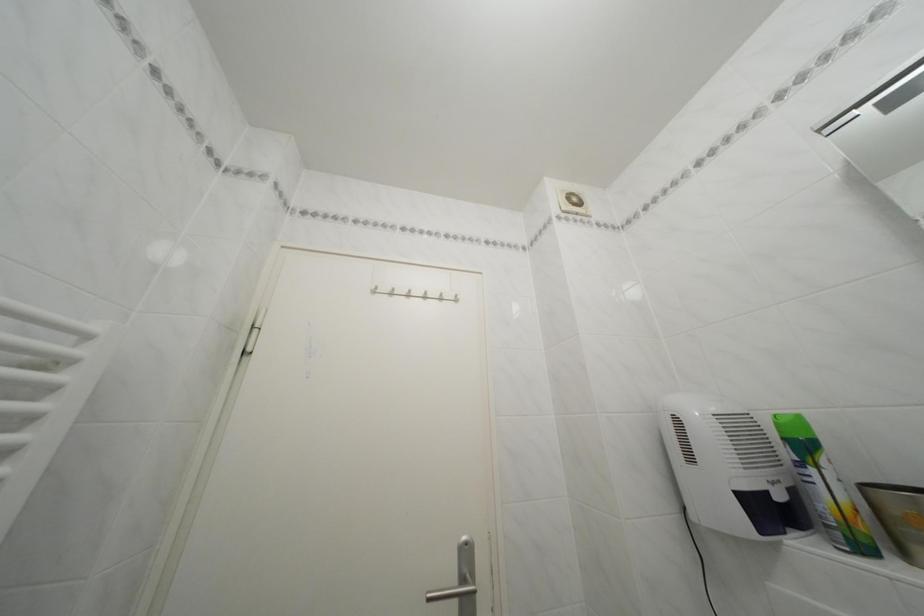
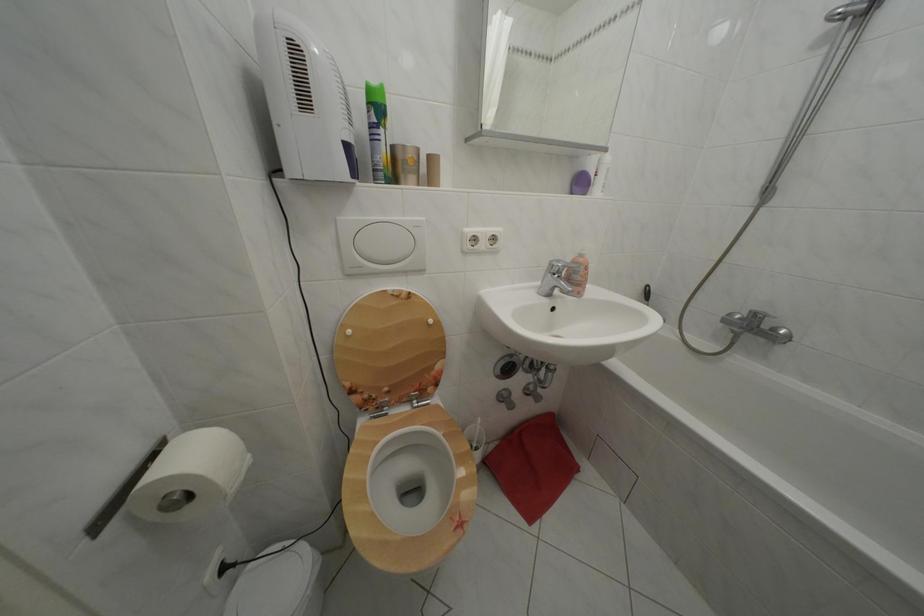
The point at (x=793, y=445) is marked in the first image. Where is the corresponding point in the second image?

(378, 110)